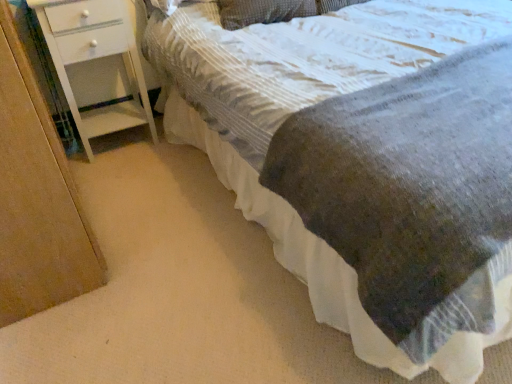
Question: Is white painted wood chest of drawers at left at the right side of textured gray pillow at upper center?

Choices:
 (A) yes
 (B) no

Answer: (B)

Question: Can you confirm if white painted wood chest of drawers at left is wider than textured gray pillow at upper center?

Choices:
 (A) no
 (B) yes

Answer: (A)

Question: Is white painted wood chest of drawers at left taller than textured gray pillow at upper center?

Choices:
 (A) no
 (B) yes

Answer: (B)

Question: Is white painted wood chest of drawers at left oriented towards textured gray pillow at upper center?

Choices:
 (A) yes
 (B) no

Answer: (B)

Question: Does white painted wood chest of drawers at left touch textured gray pillow at upper center?

Choices:
 (A) yes
 (B) no

Answer: (B)

Question: Is textured gray pillow at upper center at the back of white painted wood chest of drawers at left?

Choices:
 (A) yes
 (B) no

Answer: (B)

Question: Is textured gray blanket at center located outside textured gray pillow at upper center?

Choices:
 (A) yes
 (B) no

Answer: (A)

Question: Does textured gray blanket at center have a lesser height compared to textured gray pillow at upper center?

Choices:
 (A) yes
 (B) no

Answer: (B)

Question: Is textured gray blanket at center not close to textured gray pillow at upper center?

Choices:
 (A) yes
 (B) no

Answer: (B)

Question: Can you see textured gray blanket at center touching textured gray pillow at upper center?

Choices:
 (A) no
 (B) yes

Answer: (A)

Question: Considering the relative sizes of textured gray blanket at center and textured gray pillow at upper center in the image provided, is textured gray blanket at center thinner than textured gray pillow at upper center?

Choices:
 (A) no
 (B) yes

Answer: (A)

Question: Considering the relative sizes of textured gray blanket at center and textured gray pillow at upper center in the image provided, is textured gray blanket at center taller than textured gray pillow at upper center?

Choices:
 (A) yes
 (B) no

Answer: (A)

Question: Is textured gray pillow at upper center to the left of textured gray blanket at center from the viewer's perspective?

Choices:
 (A) yes
 (B) no

Answer: (A)